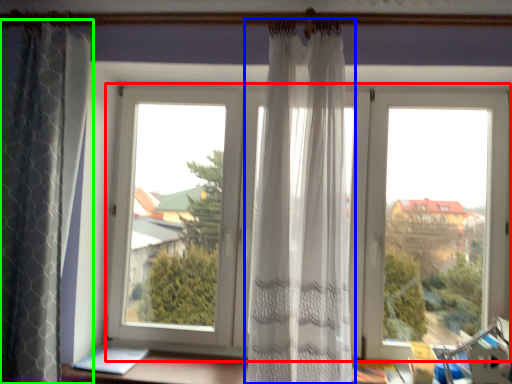
Question: Which is nearer to the window (highlighted by a red box)? curtain (highlighted by a blue box) or curtain (highlighted by a green box).

Choices:
 (A) curtain
 (B) curtain

Answer: (A)